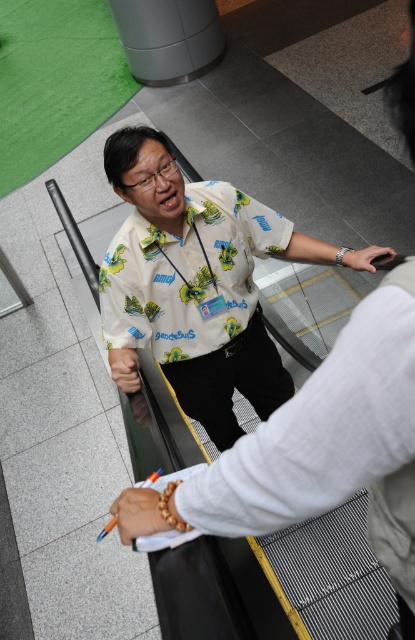
In the scene shown: You are an observer standing in front of the escalator. You notice two accessories on the person wearing the white printed shirt at center. One is the orange beaded bracelet at lower center. What can you infer about their sizes?

The white printed shirt at center has a larger size compared to the orange beaded bracelet at lower center, so the shirt is bigger than the bracelet.

You are standing at the bottom of the escalator and see the white printed shirt at center and the matte black hand at center. Which object is larger in size?

The white printed shirt at center is bigger than the matte black hand at center.

You are a security guard monitoring the escalator area. You need to check if the distance between the white printed shirt at center and the orange beaded bracelet at lower center is within the 1.2 meter safety zone. Is the distance compliant?

The distance between the white printed shirt at center and the orange beaded bracelet at lower center is 1.08 meters, which is within the 1.2 meter safety zone. Therefore, the distance is compliant.